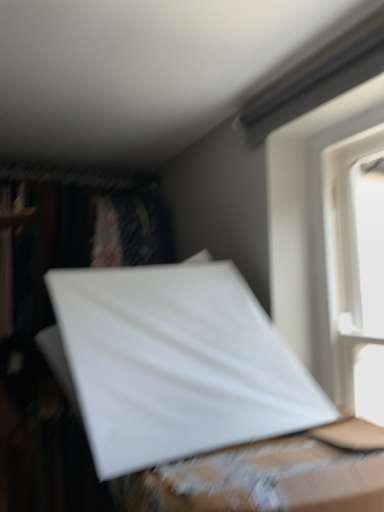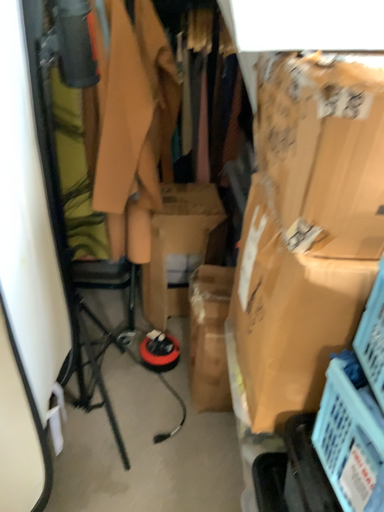
Question: Which way did the camera rotate in the video?

Choices:
 (A) rotated left
 (B) rotated right

Answer: (A)